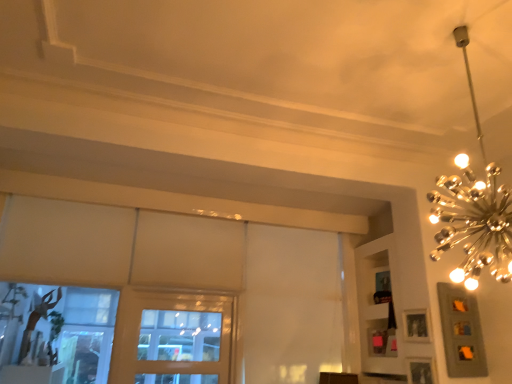
Where is `wooden window at center`? The height and width of the screenshot is (384, 512). wooden window at center is located at coordinates (179, 336).

This screenshot has height=384, width=512. Identify the location of gold metallic chandelier at upper right. (474, 223).

Is wooden picture frame at lower right, the first picture frame ordered from the bottom, far from gold metallic chandelier at upper right?

That's right, there is a large distance between wooden picture frame at lower right, the first picture frame ordered from the bottom, and gold metallic chandelier at upper right.

Who is bigger, wooden picture frame at lower right, the first picture frame ordered from the bottom, or gold metallic chandelier at upper right?

gold metallic chandelier at upper right is bigger.

From the image's perspective, does wooden picture frame at lower right, the first picture frame ordered from the bottom, appear lower than gold metallic chandelier at upper right?

Correct, wooden picture frame at lower right, the first picture frame ordered from the bottom, appears lower than gold metallic chandelier at upper right in the image.

Is wooden picture frame at lower right, marked as the 2th picture frame in a top-to-bottom arrangement, turned away from gold metallic chandelier at upper right?

No, gold metallic chandelier at upper right is not at the back of wooden picture frame at lower right, marked as the 2th picture frame in a top-to-bottom arrangement.

Considering the positions of points (410, 372) and (380, 352), is point (410, 372) closer to camera compared to point (380, 352)?

Yes, it is.

Visually, is wooden picture frame at lower right, marked as the 2th picture frame in a top-to-bottom arrangement, positioned to the left or to the right of white matte shelf at upper right?

Based on their positions, wooden picture frame at lower right, marked as the 2th picture frame in a top-to-bottom arrangement, is located to the right of white matte shelf at upper right.

Is wooden picture frame at lower right, the first picture frame ordered from the bottom, looking in the opposite direction of white matte shelf at upper right?

wooden picture frame at lower right, the first picture frame ordered from the bottom, does not have its back to white matte shelf at upper right.

Which point is more distant from viewer, (143, 357) or (401, 349)?

Positioned behind is point (143, 357).

In terms of width, does wooden window at center look wider or thinner when compared to white matte shelf at upper right?

wooden window at center is thinner than white matte shelf at upper right.

Where is `shelf located above the wooden window at center (from a real-world perspective)`? This screenshot has width=512, height=384. shelf located above the wooden window at center (from a real-world perspective) is located at coordinates (377, 307).

How many degrees apart are the facing directions of wooden window at center and white matte shelf at upper right?

wooden window at center and white matte shelf at upper right are facing 90.1 degrees away from each other.

From a real-world perspective, is wooden window at center positioned above or below gold metallic chandelier at upper right?

From a real-world perspective, wooden window at center is physically below gold metallic chandelier at upper right.

Considering the relative sizes of wooden window at center and gold metallic chandelier at upper right in the image provided, is wooden window at center smaller than gold metallic chandelier at upper right?

Correct, wooden window at center occupies less space than gold metallic chandelier at upper right.

Which of these two, wooden window at center or gold metallic chandelier at upper right, stands taller?

Standing taller between the two is gold metallic chandelier at upper right.

Does white matte shelf at upper right have a larger size compared to gold metallic chandelier at upper right?

No.

Is white matte shelf at upper right positioned with its back to gold metallic chandelier at upper right?

No, gold metallic chandelier at upper right is not at the back of white matte shelf at upper right.

Can gold metallic chandelier at upper right be found inside white matte shelf at upper right?

No, gold metallic chandelier at upper right is located outside of white matte shelf at upper right.

From a real-world perspective, is white matte shelf at upper right over gold metallic chandelier at upper right?

Incorrect, from a real-world perspective, white matte shelf at upper right is lower than gold metallic chandelier at upper right.

Does wooden window at center have a smaller size compared to wooden picture frame at lower right, the first picture frame ordered from the bottom?

Incorrect, wooden window at center is not smaller in size than wooden picture frame at lower right, the first picture frame ordered from the bottom.

From a real-world perspective, which object stands above the other?

wooden window at center is physically above.

Is matte silver picture frame at upper right, the first picture frame positioned from the top, facing away from wooden picture frame at lower right, marked as the 2th picture frame in a top-to-bottom arrangement?

That's not correct — matte silver picture frame at upper right, the first picture frame positioned from the top, is not looking away from wooden picture frame at lower right, marked as the 2th picture frame in a top-to-bottom arrangement.

Which of these two, matte silver picture frame at upper right, the first picture frame positioned from the top, or wooden picture frame at lower right, marked as the 2th picture frame in a top-to-bottom arrangement, stands taller?

matte silver picture frame at upper right, the first picture frame positioned from the top.

Considering the sizes of objects matte silver picture frame at upper right, the first picture frame positioned from the top, and wooden picture frame at lower right, the first picture frame ordered from the bottom, in the image provided, who is smaller, matte silver picture frame at upper right, the first picture frame positioned from the top, or wooden picture frame at lower right, the first picture frame ordered from the bottom,?

wooden picture frame at lower right, the first picture frame ordered from the bottom.

Is matte silver picture frame at upper right, the first picture frame positioned from the top, with wooden picture frame at lower right, marked as the 2th picture frame in a top-to-bottom arrangement?

No, matte silver picture frame at upper right, the first picture frame positioned from the top, is not next to wooden picture frame at lower right, marked as the 2th picture frame in a top-to-bottom arrangement.

From the image's perspective, starting from the gold metallic chandelier at upper right, which picture frame is the 2nd one below? Please provide its 2D coordinates.

[(421, 370)]

From a real-world perspective, count 2nd picture frames downward from the white matte shelf at upper right and point to it. Please provide its 2D coordinates.

[(421, 370)]

From the image, which object appears to be nearer to gold metallic chandelier at upper right, matte silver picture frame at upper right, the first picture frame positioned from the top, or white matte shelf at upper right?

Based on the image, matte silver picture frame at upper right, the first picture frame positioned from the top, appears to be nearer to gold metallic chandelier at upper right.

Looking at the image, which one is located closer to gold metallic chandelier at upper right, white matte shelf at upper right or matte silver picture frame at upper right, the first picture frame positioned from the top?

matte silver picture frame at upper right, the first picture frame positioned from the top, is positioned closer to the anchor gold metallic chandelier at upper right.

Estimate the real-world distances between objects in this image. Which object is closer to matte silver picture frame at upper right, which ranks as the 2th picture frame in bottom-to-top order, white matte shelf at upper right or wooden picture frame at lower right, the first picture frame ordered from the bottom?

wooden picture frame at lower right, the first picture frame ordered from the bottom, lies closer to matte silver picture frame at upper right, which ranks as the 2th picture frame in bottom-to-top order, than the other object.

Based on their spatial positions, is matte silver picture frame at upper right, the first picture frame positioned from the top, or gold metallic chandelier at upper right closer to wooden window at center?

matte silver picture frame at upper right, the first picture frame positioned from the top, is closer to wooden window at center.

When comparing their distances from matte silver picture frame at upper right, the first picture frame positioned from the top, does wooden window at center or gold metallic chandelier at upper right seem closer?

Among the two, gold metallic chandelier at upper right is located nearer to matte silver picture frame at upper right, the first picture frame positioned from the top.

Which object lies nearer to the anchor point wooden picture frame at lower right, marked as the 2th picture frame in a top-to-bottom arrangement, wooden window at center or white matte shelf at upper right?

Among the two, white matte shelf at upper right is located nearer to wooden picture frame at lower right, marked as the 2th picture frame in a top-to-bottom arrangement.

From the image, which object appears to be nearer to wooden picture frame at lower right, the first picture frame ordered from the bottom, white matte shelf at upper right or gold metallic chandelier at upper right?

The object closer to wooden picture frame at lower right, the first picture frame ordered from the bottom, is white matte shelf at upper right.

Which object lies nearer to the anchor point wooden picture frame at lower right, marked as the 2th picture frame in a top-to-bottom arrangement, white matte shelf at upper right or wooden window at center?

white matte shelf at upper right.

Identify the location of shelf between matte silver picture frame at upper right, the first picture frame positioned from the top, and wooden picture frame at lower right, marked as the 2th picture frame in a top-to-bottom arrangement, vertically. (377, 307).

Identify the location of picture frame between gold metallic chandelier at upper right and matte silver picture frame at upper right, the first picture frame positioned from the top, from front to back. This screenshot has width=512, height=384. (421, 370).

You are a GUI agent. You are given a task and a screenshot of the screen. Output one action in this format:
    pyautogui.click(x=<x>, y=<y>)
    Task: Click on the picture frame located between wooden window at center and matte silver picture frame at upper right, the first picture frame positioned from the top, in the left-right direction
    Image resolution: width=512 pixels, height=384 pixels.
    Given the screenshot: What is the action you would take?
    pyautogui.click(x=421, y=370)

This screenshot has height=384, width=512. In order to click on shelf between wooden window at center and matte silver picture frame at upper right, which ranks as the 2th picture frame in bottom-to-top order, in the horizontal direction in this screenshot , I will do `click(377, 307)`.